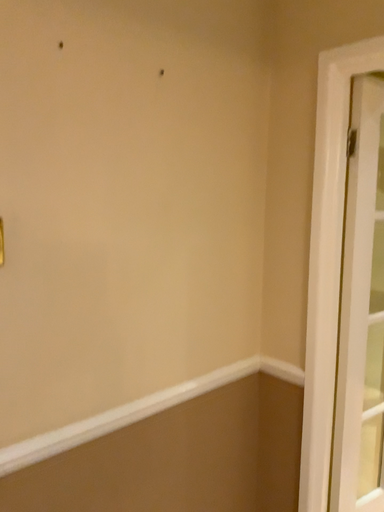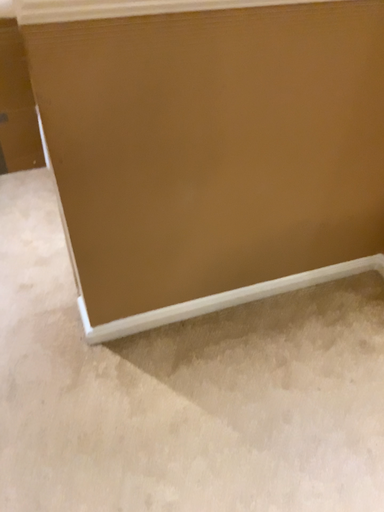
Question: Which way did the camera rotate in the video?

Choices:
 (A) rotated right
 (B) rotated left

Answer: (B)